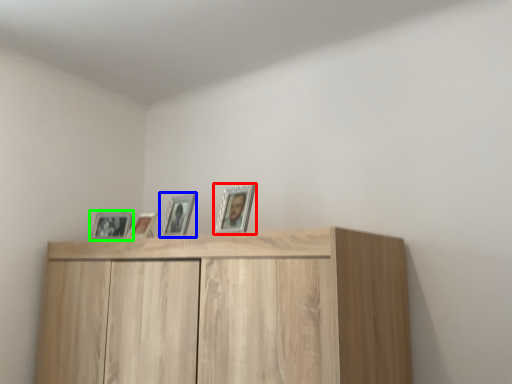
Question: Which is farther away from picture frame (highlighted by a red box)? picture frame (highlighted by a blue box) or picture frame (highlighted by a green box)?

Choices:
 (A) picture frame
 (B) picture frame

Answer: (B)